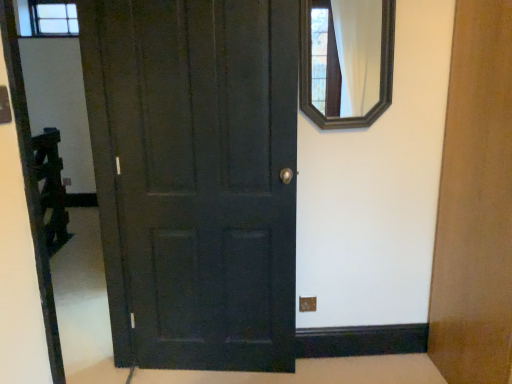
Question: From a real-world perspective, relative to matte dark wood door at center, is wooden-framed mirror at upper right vertically above or below?

Choices:
 (A) above
 (B) below

Answer: (A)

Question: Is wooden-framed mirror at upper right in front of or behind matte dark wood door at center in the image?

Choices:
 (A) behind
 (B) front

Answer: (A)

Question: Would you say wooden-framed mirror at upper right is to the left or to the right of matte dark wood door at center in the picture?

Choices:
 (A) left
 (B) right

Answer: (B)

Question: Based on their positions, is matte dark wood door at center located to the left or right of wooden-framed mirror at upper right?

Choices:
 (A) right
 (B) left

Answer: (B)

Question: In terms of size, does matte dark wood door at center appear bigger or smaller than wooden-framed mirror at upper right?

Choices:
 (A) big
 (B) small

Answer: (A)

Question: Is matte dark wood door at center in front of or behind wooden-framed mirror at upper right in the image?

Choices:
 (A) front
 (B) behind

Answer: (A)

Question: Would you say matte dark wood door at center is inside or outside wooden-framed mirror at upper right?

Choices:
 (A) inside
 (B) outside

Answer: (B)